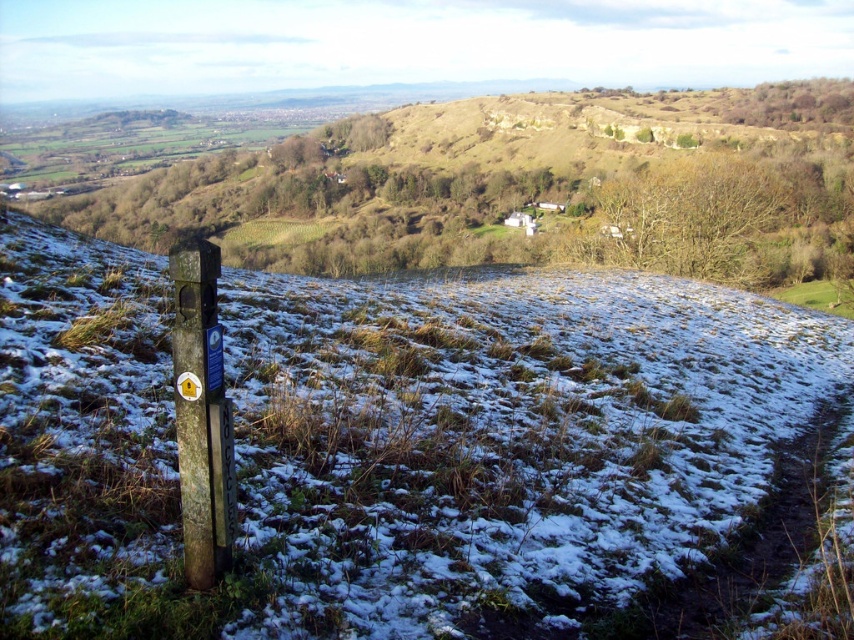
You are standing at the wooden post in the lower left corner and want to walk to the green grass at center. Which direction should you head?

You should head towards the center direction from the wooden post in the lower left corner to reach the green grass at center.

You are standing on the green grass at center and want to walk towards the dark brown wooden post at lower left. Which direction should you move to get closer to the post?

You should move backward because the green grass at center is in front of the dark brown wooden post at lower left, meaning the post is behind you from your current position on the grass.

You are planning to set up a small tent for a quick rest. Given the image, where would be the most suitable location between the green grass at center and the dark brown wooden post at lower left? Explain your choice based on their sizes.

The green grass at center is larger in size than the dark brown wooden post at lower left, making it a more suitable location to set up the tent as there is enough space.